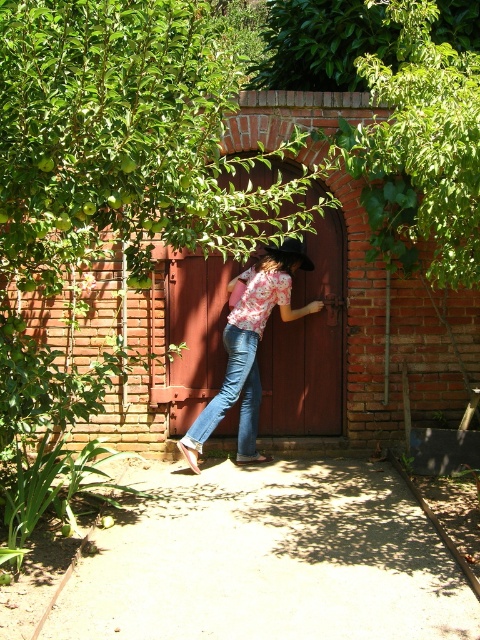
Question: Which of the following is the farthest from the observer?

Choices:
 (A) (279, 294)
 (B) (244, 403)
 (C) (294, 252)

Answer: (C)

Question: Which object is positioned farthest from the floral shirt and jeans at center?

Choices:
 (A) brown felt cowboy hat at center
 (B) denim jeans at center

Answer: (A)

Question: Is floral shirt and jeans at center below denim jeans at center?

Choices:
 (A) no
 (B) yes

Answer: (A)

Question: Does floral shirt and jeans at center have a larger size compared to denim jeans at center?

Choices:
 (A) no
 (B) yes

Answer: (B)

Question: Which point is farther to the camera?

Choices:
 (A) brown felt cowboy hat at center
 (B) denim jeans at center

Answer: (B)

Question: Observing the image, what is the correct spatial positioning of floral shirt and jeans at center in reference to brown felt cowboy hat at center?

Choices:
 (A) below
 (B) above

Answer: (A)